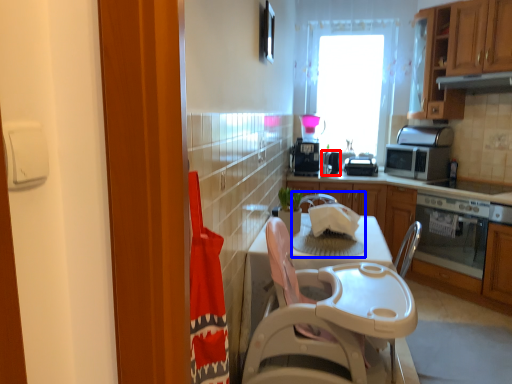
Question: Which of the following is the closest to the observer, appliance (highlighted by a red box) or sink (highlighted by a blue box)?

Choices:
 (A) appliance
 (B) sink

Answer: (B)